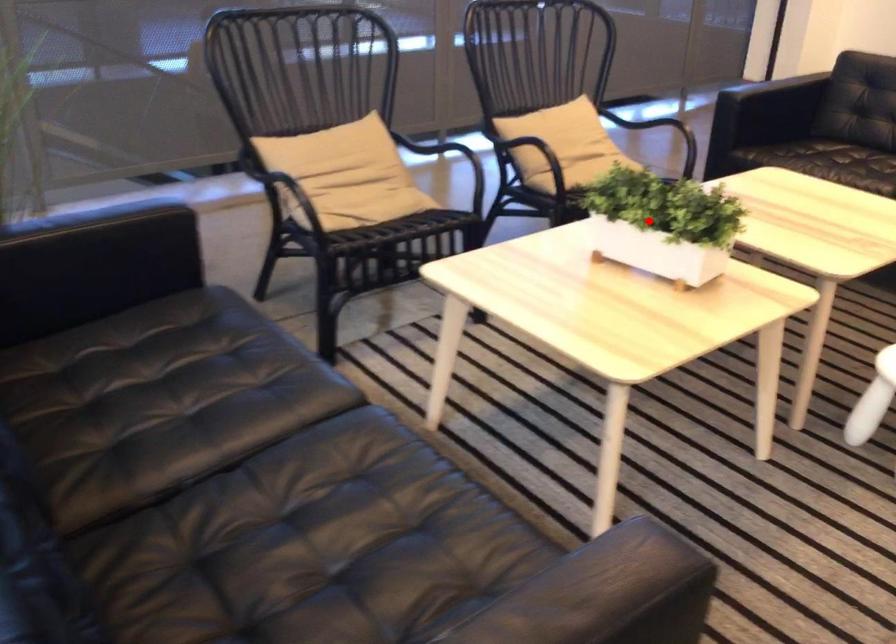
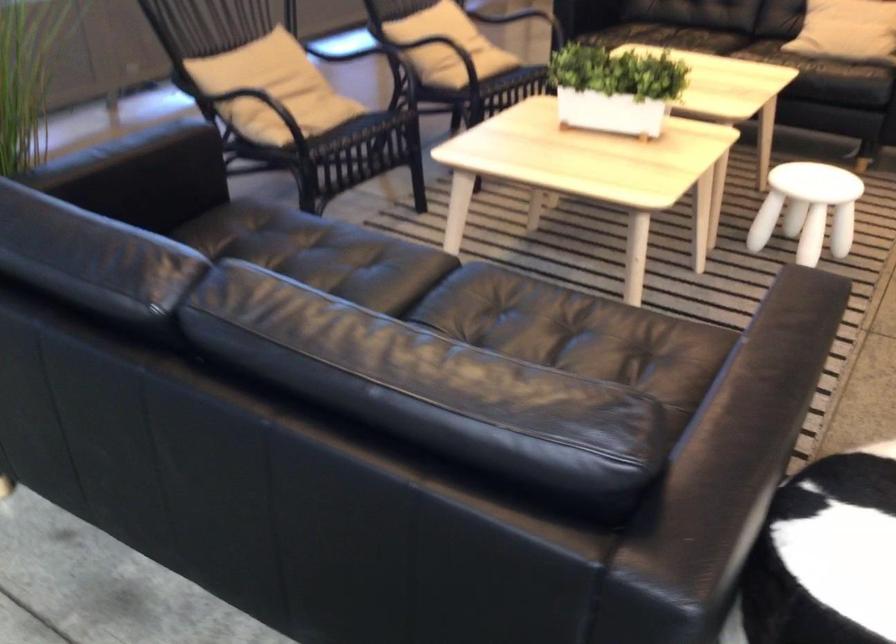
The point at the highlighted location is marked in the first image. Where is the corresponding point in the second image?

(615, 88)